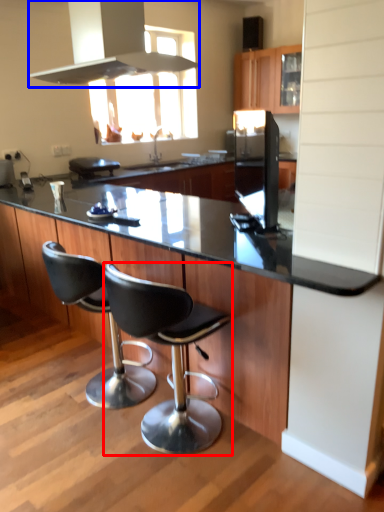
Question: Among these objects, which one is farthest to the camera, chair (highlighted by a red box) or exhaust hood (highlighted by a blue box)?

Choices:
 (A) chair
 (B) exhaust hood

Answer: (B)